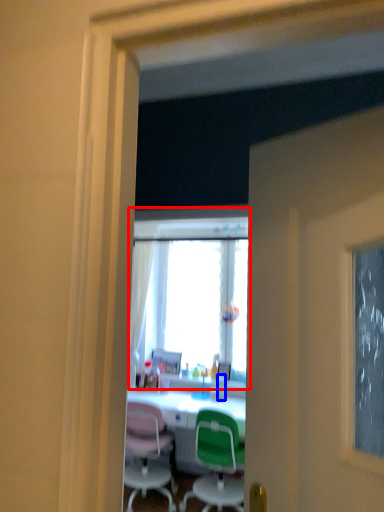
Question: Which object appears farthest to the camera in this image, window (highlighted by a red box) or bottle (highlighted by a blue box)?

Choices:
 (A) window
 (B) bottle

Answer: (B)